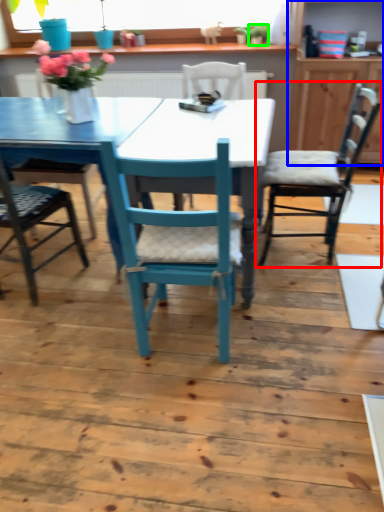
Question: Which is nearer to the chair (highlighted by a red box)? dresser (highlighted by a blue box) or houseplant (highlighted by a green box).

Choices:
 (A) dresser
 (B) houseplant

Answer: (A)